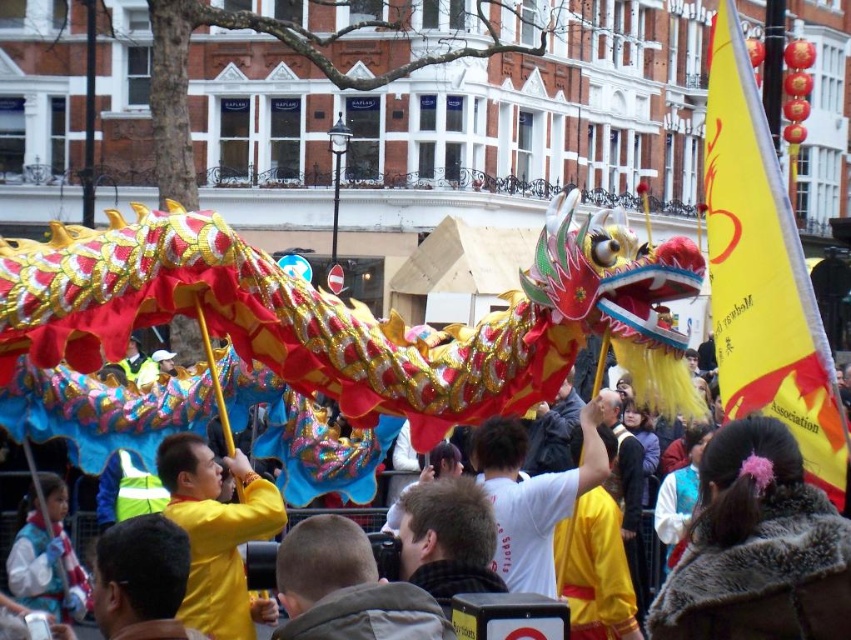
You are a photographer at the Chinese New Year celebration. You want to take a photo of both the yellow fabric headscarf at center and the yellow fabric head at center. Which one should you focus on first to ensure it appears sharp in the photo?

The yellow fabric headscarf at center is further to the viewer than yellow fabric head at center, so you should focus on the yellow fabric headscarf at center first to ensure it appears sharp.

Looking at this image, you are a photographer at the Chinese New Year celebration. You want to capture a photo of the dragon performance. However, there is a fuzzy brown coat at center and a yellow fabric at center in your way. Which object is closer to you so that you can decide whether to move closer or step back?

The fuzzy brown coat at center is shorter than the yellow fabric at center, so the fuzzy brown coat at center is closer to you. You can move closer to avoid it or step back to include both in the frame.